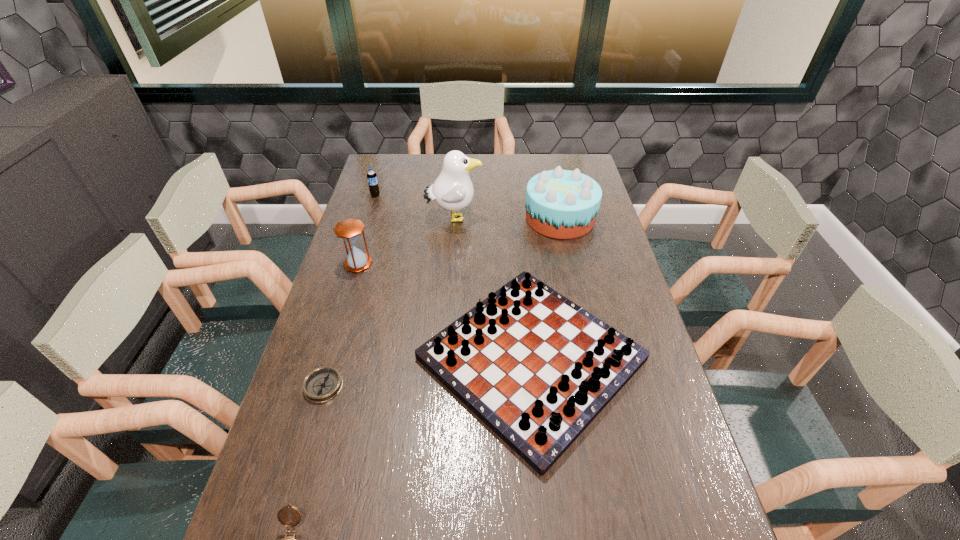
Find the location of `blank area located on the front of the hourglass`. blank area located on the front of the hourglass is located at coordinates (328, 364).

Find the location of a particular element. vacant space located on the front of the soda bottle is located at coordinates (370, 213).

Image resolution: width=960 pixels, height=540 pixels. Find the location of `vacant space located on the left of the chessboard`. vacant space located on the left of the chessboard is located at coordinates (318, 359).

In order to click on vacant space located 0.280m on the right of the farther compass in this screenshot , I will do `click(453, 386)`.

This screenshot has height=540, width=960. Find the location of `hourglass located in the left edge section of the desktop`. hourglass located in the left edge section of the desktop is located at coordinates (349, 230).

Find the location of a particular element. The height and width of the screenshot is (540, 960). soda bottle present at the left edge is located at coordinates (372, 180).

Find the location of a particular element. compass that is positioned at the left edge is located at coordinates (322, 384).

This screenshot has height=540, width=960. Identify the location of cake present at the right edge. (563, 204).

Where is `chessboard that is at the right edge`? This screenshot has height=540, width=960. chessboard that is at the right edge is located at coordinates (536, 368).

Where is `free space at the far edge`? This screenshot has height=540, width=960. free space at the far edge is located at coordinates (523, 154).